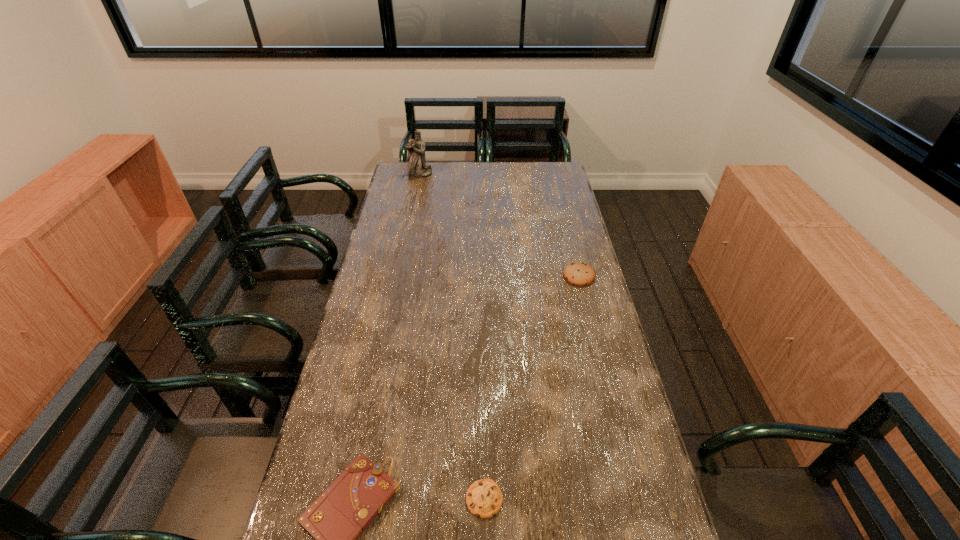
Where is `vacant area that lies between the third nearest object and the shortest object`? This screenshot has width=960, height=540. vacant area that lies between the third nearest object and the shortest object is located at coordinates (532, 387).

Locate an element on the screen. the closest object to the rightmost object is located at coordinates (484, 499).

What are the coordinates of `object that can be found as the closest to the farther cookie` in the screenshot? It's located at (484, 499).

Locate an element on the screen. Image resolution: width=960 pixels, height=540 pixels. vacant space that satisfies the following two spatial constraints: 1. on the front-facing side of the nearer cookie; 2. on the right side of the tallest object is located at coordinates (353, 498).

This screenshot has height=540, width=960. Find the location of `vacant space that satisfies the following two spatial constraints: 1. on the front-facing side of the shortest object; 2. on the right side of the farthest object`. vacant space that satisfies the following two spatial constraints: 1. on the front-facing side of the shortest object; 2. on the right side of the farthest object is located at coordinates (353, 498).

Locate an element on the screen. free space that satisfies the following two spatial constraints: 1. on the front-facing side of the taller cookie; 2. on the right side of the tallest object is located at coordinates (399, 276).

Where is `free space that satisfies the following two spatial constraints: 1. on the front-facing side of the tallest object; 2. on the right side of the taller cookie`? This screenshot has width=960, height=540. free space that satisfies the following two spatial constraints: 1. on the front-facing side of the tallest object; 2. on the right side of the taller cookie is located at coordinates (399, 276).

The height and width of the screenshot is (540, 960). In order to click on vacant space that satisfies the following two spatial constraints: 1. on the front-facing side of the right cookie; 2. on the left side of the figurine in this screenshot , I will do `click(399, 276)`.